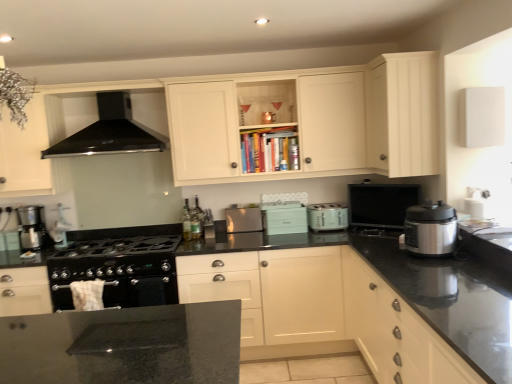
Question: From the image's perspective, is matte black monitor at upper right, acting as the 1th appliance starting from the right, beneath satin silver toaster at center, the 4th kitchen appliance viewed from the front?

Choices:
 (A) yes
 (B) no

Answer: (B)

Question: Does matte black monitor at upper right, which is counted as the second appliance, starting from the left, have a smaller size compared to satin silver toaster at center, the first kitchen appliance positioned from the back?

Choices:
 (A) no
 (B) yes

Answer: (A)

Question: Is matte black monitor at upper right, acting as the 1th appliance starting from the right, at the left side of satin silver toaster at center, marked as the third kitchen appliance in a right-to-left arrangement?

Choices:
 (A) yes
 (B) no

Answer: (B)

Question: Considering the relative sizes of matte black monitor at upper right, acting as the 1th appliance starting from the right, and satin silver toaster at center, which ranks as the second kitchen appliance in left-to-right order, in the image provided, is matte black monitor at upper right, acting as the 1th appliance starting from the right, wider than satin silver toaster at center, which ranks as the second kitchen appliance in left-to-right order,?

Choices:
 (A) yes
 (B) no

Answer: (B)

Question: Is matte black monitor at upper right, which is counted as the second appliance, starting from the left, to the right of satin silver toaster at center, the 4th kitchen appliance viewed from the front, from the viewer's perspective?

Choices:
 (A) yes
 (B) no

Answer: (A)

Question: Does matte black monitor at upper right, which is counted as the second appliance, starting from the left, have a lesser width compared to satin silver toaster at center, marked as the third kitchen appliance in a right-to-left arrangement?

Choices:
 (A) no
 (B) yes

Answer: (B)

Question: Is matte silver toaster at center, which is the second kitchen appliance from back to front, wider than white matte cabinet at upper right, marked as the 1th cabinetry in a top-to-bottom arrangement?

Choices:
 (A) yes
 (B) no

Answer: (B)

Question: Is the depth of matte silver toaster at center, which ranks as the 2th kitchen appliance in right-to-left order, less than that of white matte cabinet at upper right, the fourth cabinetry when ordered from bottom to top?

Choices:
 (A) no
 (B) yes

Answer: (A)

Question: Can you confirm if matte silver toaster at center, which ranks as the 2th kitchen appliance in right-to-left order, is positioned to the right of white matte cabinet at upper right, marked as the 1th cabinetry in a top-to-bottom arrangement?

Choices:
 (A) yes
 (B) no

Answer: (B)

Question: Is matte silver toaster at center, which is the second kitchen appliance from back to front, looking in the opposite direction of white matte cabinet at upper right, marked as the 1th cabinetry in a top-to-bottom arrangement?

Choices:
 (A) yes
 (B) no

Answer: (B)

Question: Is matte silver toaster at center, which is the second kitchen appliance from back to front, taller than white matte cabinet at upper right, the fourth cabinetry when ordered from bottom to top?

Choices:
 (A) yes
 (B) no

Answer: (B)

Question: Is matte silver toaster at center, which ranks as the 2th kitchen appliance in right-to-left order, next to white matte cabinet at upper right, marked as the 1th cabinetry in a top-to-bottom arrangement, and touching it?

Choices:
 (A) no
 (B) yes

Answer: (A)

Question: Is light teal plastic toaster at center, the second appliance when ordered from right to left, taller than metallic silver coffee maker at left, the second kitchen appliance in the front-to-back sequence?

Choices:
 (A) yes
 (B) no

Answer: (B)